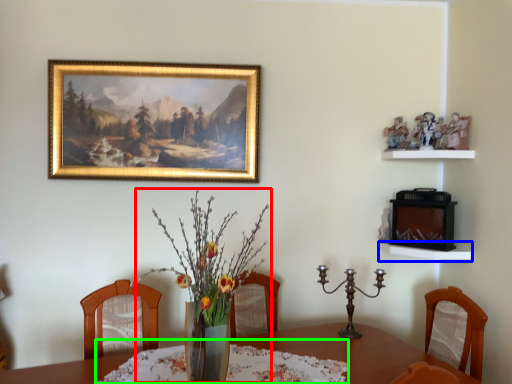
Question: Considering the real-world distances, which object is farthest from floral arrangement (highlighted by a red box)? shelf (highlighted by a blue box) or tablecloth (highlighted by a green box)?

Choices:
 (A) shelf
 (B) tablecloth

Answer: (A)